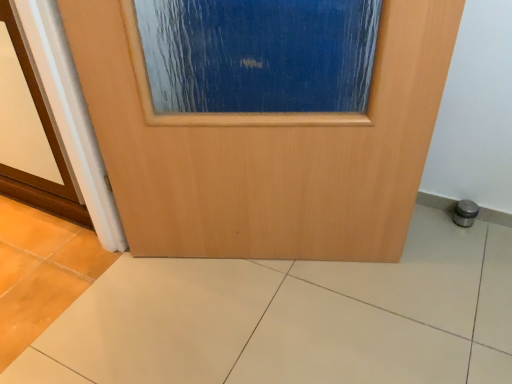
Question: Does blue textured glass at center have a greater width compared to wooden door at center?

Choices:
 (A) yes
 (B) no

Answer: (A)

Question: Does blue textured glass at center turn towards wooden door at center?

Choices:
 (A) no
 (B) yes

Answer: (B)

Question: Considering the relative sizes of blue textured glass at center and wooden door at center in the image provided, is blue textured glass at center thinner than wooden door at center?

Choices:
 (A) no
 (B) yes

Answer: (A)

Question: Does blue textured glass at center have a greater height compared to wooden door at center?

Choices:
 (A) no
 (B) yes

Answer: (A)

Question: Can you see blue textured glass at center touching wooden door at center?

Choices:
 (A) no
 (B) yes

Answer: (A)

Question: Is blue textured glass at center looking in the opposite direction of wooden door at center?

Choices:
 (A) yes
 (B) no

Answer: (B)

Question: Is blue textured glass at center completely or partially inside wooden door at center?

Choices:
 (A) yes
 (B) no

Answer: (B)

Question: Is the position of wooden door at center more distant than that of blue textured glass at center?

Choices:
 (A) no
 (B) yes

Answer: (A)

Question: From a real-world perspective, is wooden door at center beneath blue textured glass at center?

Choices:
 (A) yes
 (B) no

Answer: (A)

Question: Can you confirm if wooden door at center is wider than blue textured glass at center?

Choices:
 (A) yes
 (B) no

Answer: (B)

Question: Is wooden door at center oriented away from blue textured glass at center?

Choices:
 (A) yes
 (B) no

Answer: (A)

Question: Can you confirm if wooden door at center is positioned to the left of blue textured glass at center?

Choices:
 (A) no
 (B) yes

Answer: (B)

Question: From the image's perspective, is blue textured glass at center on top of beige ceramic tile at center?

Choices:
 (A) no
 (B) yes

Answer: (B)